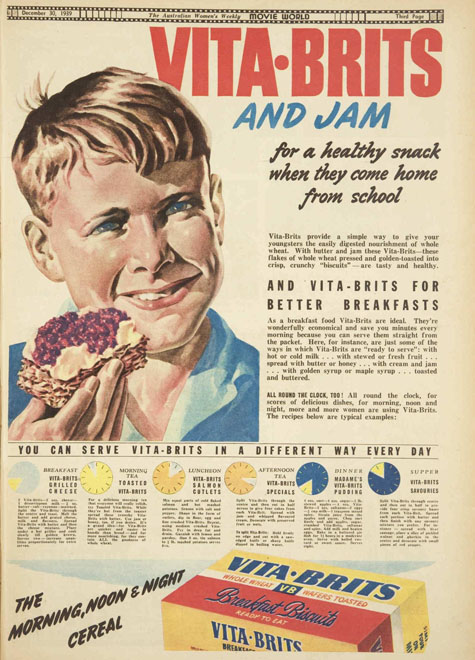
At what (x,y) coordinates should I click in order to perform the action: click on newspaper. Please return your answer as a coordinate pair (x, y). The height and width of the screenshot is (660, 475). Looking at the image, I should click on (258, 249).